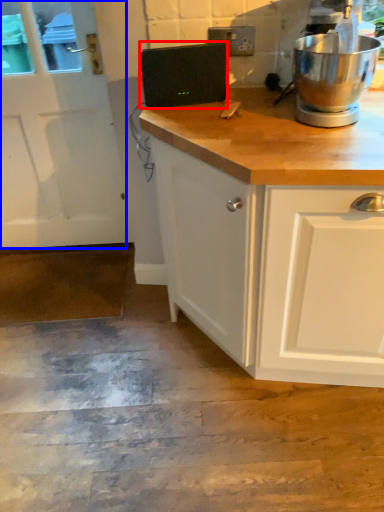
Question: Which point is closer to the camera, appliance (highlighted by a red box) or screen door (highlighted by a blue box)?

Choices:
 (A) appliance
 (B) screen door

Answer: (A)